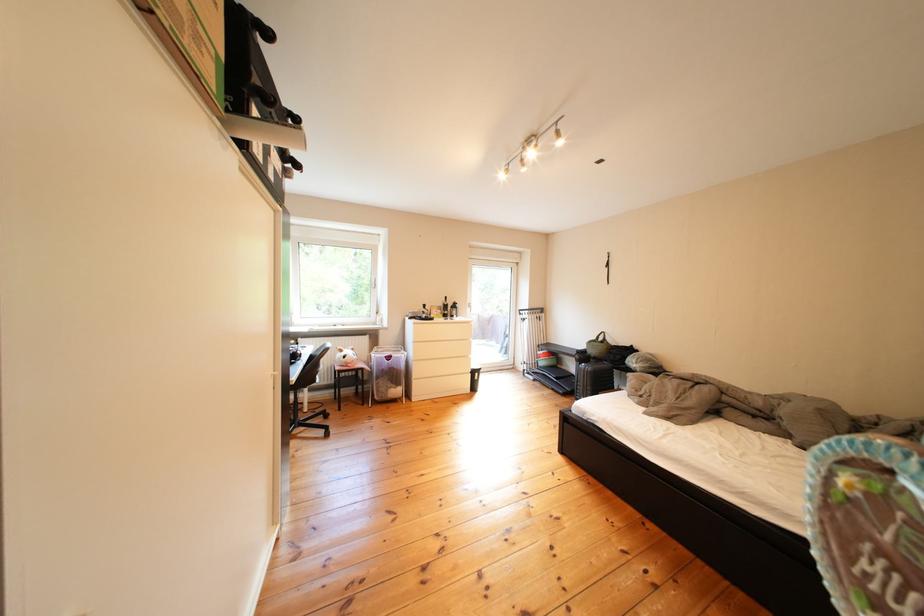
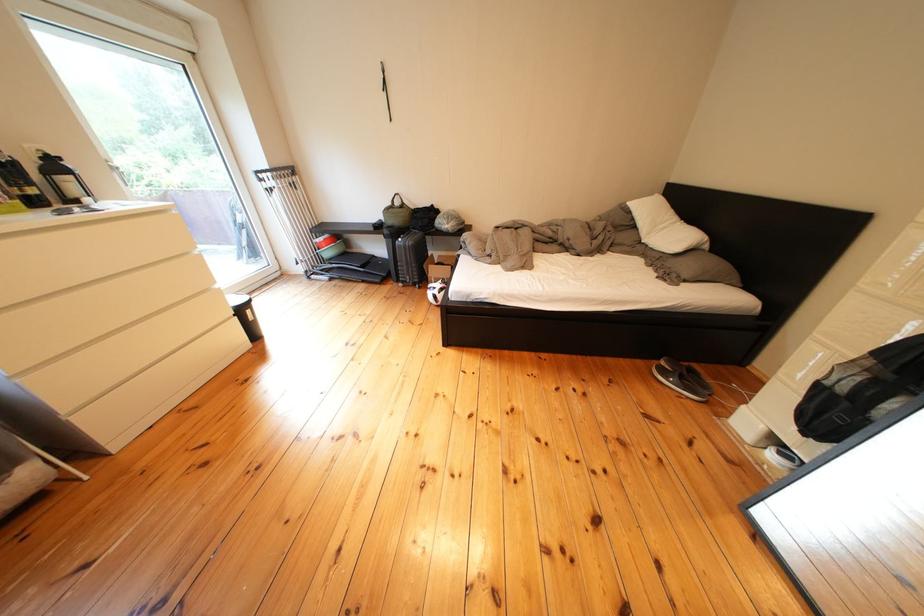
Where in the second image is the point corresponding to point (518, 350) from the first image?

(259, 248)